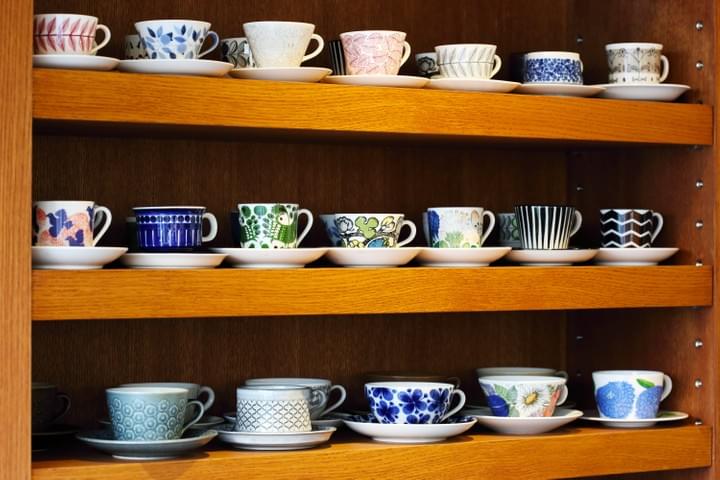
Locate an element on the screen. The width and height of the screenshot is (720, 480). sets of cups and saucers on bottom shelf is located at coordinates (641, 401), (544, 416), (546, 367), (436, 420), (444, 379), (297, 427), (330, 397), (179, 429), (207, 395).